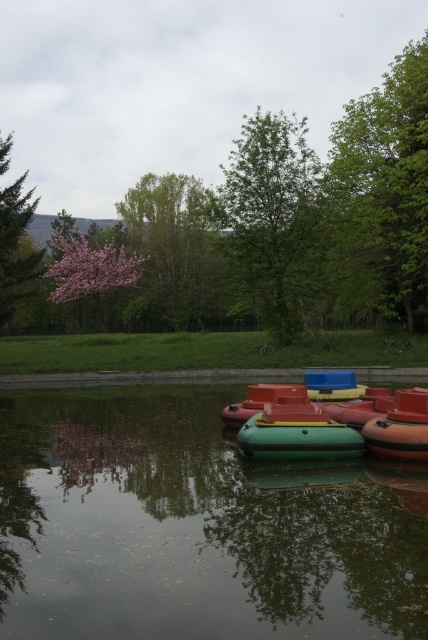
You are standing at the edge of the water and want to take a photo of the green rubber boats at lower center and the glossy plastic boats at center. Which boat type will appear closer to the camera in the photo?

The green rubber boats at lower center will appear closer to the camera in the photo because they are positioned in front of the glossy plastic boats at center.

You are planning to take a photo of the green rubber boat at center and the pink blossoming tree at upper left from the shore. Which object will appear taller in the photo?

The pink blossoming tree at upper left will appear taller in the photo because it is taller than the green rubber boat at center.

You are standing at the edge of the pond and notice two points marked in the image. Which point, point [113,499] or point [59,232], is closer to you?

Point [113,499] is closer to the camera than point [59,232], so it is closer to you.